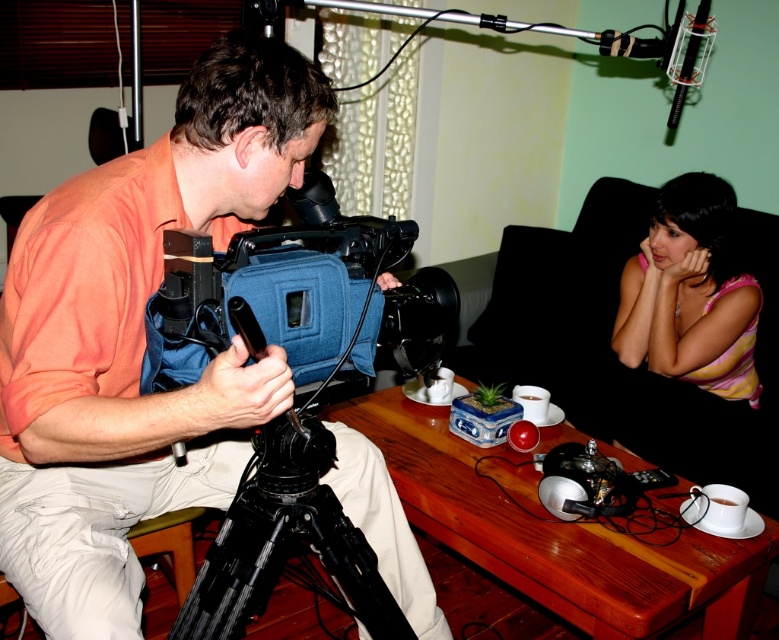
Question: Estimate the real-world distances between objects in this image. Which object is farther from the black rubberized camera at center?

Choices:
 (A) black fabric couch at right
 (B) pink striped shirt at upper right
 (C) wooden table at center

Answer: (A)

Question: Can you confirm if wooden table at center is positioned to the right of black rubberized camera at center?

Choices:
 (A) yes
 (B) no

Answer: (A)

Question: Is wooden table at center to the left of black rubberized camera at center from the viewer's perspective?

Choices:
 (A) no
 (B) yes

Answer: (A)

Question: Among these points, which one is farthest from the camera?

Choices:
 (A) (756, 328)
 (B) (739, 605)
 (C) (143, 253)
 (D) (280, 490)

Answer: (A)

Question: Does orange fabric camera at left have a greater width compared to pink striped shirt at upper right?

Choices:
 (A) yes
 (B) no

Answer: (A)

Question: Which of the following is the closest to the observer?

Choices:
 (A) wooden table at center
 (B) black fabric couch at right

Answer: (A)